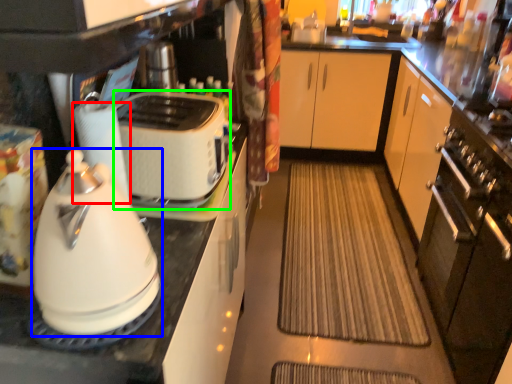
Question: Which is farther away from paper towel (highlighted by a red box)? kitchen appliance (highlighted by a blue box) or toaster (highlighted by a green box)?

Choices:
 (A) kitchen appliance
 (B) toaster

Answer: (A)